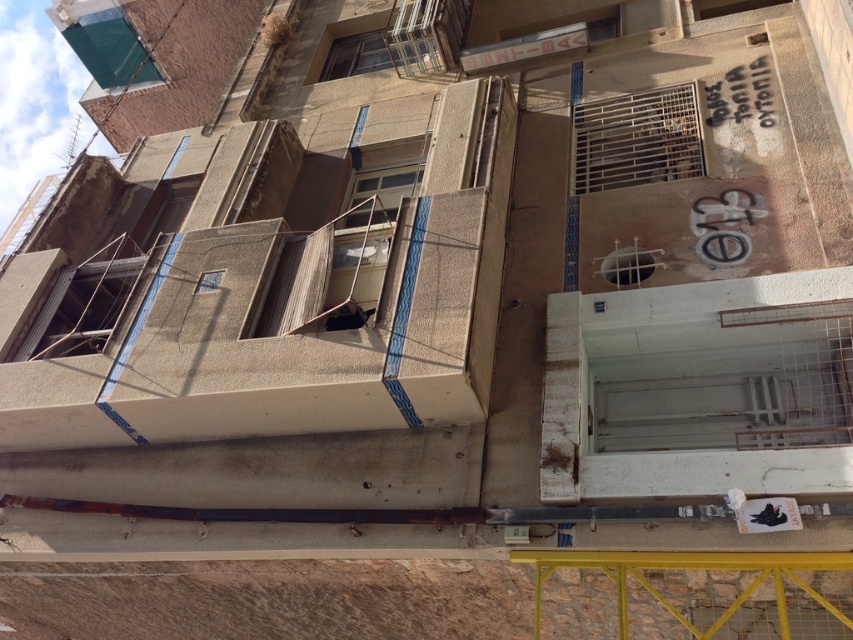
Question: Does concrete textured balcony at center appear on the right side of white concrete balcony at lower right?

Choices:
 (A) yes
 (B) no

Answer: (B)

Question: Does concrete textured balcony at center appear under white concrete balcony at lower right?

Choices:
 (A) yes
 (B) no

Answer: (B)

Question: Is concrete textured balcony at center thinner than white concrete balcony at lower right?

Choices:
 (A) no
 (B) yes

Answer: (B)

Question: Among these objects, which one is nearest to the camera?

Choices:
 (A) concrete textured balcony at center
 (B) white concrete balcony at lower right

Answer: (B)

Question: Which point is closer to the camera taking this photo?

Choices:
 (A) (36, 401)
 (B) (653, 486)

Answer: (B)